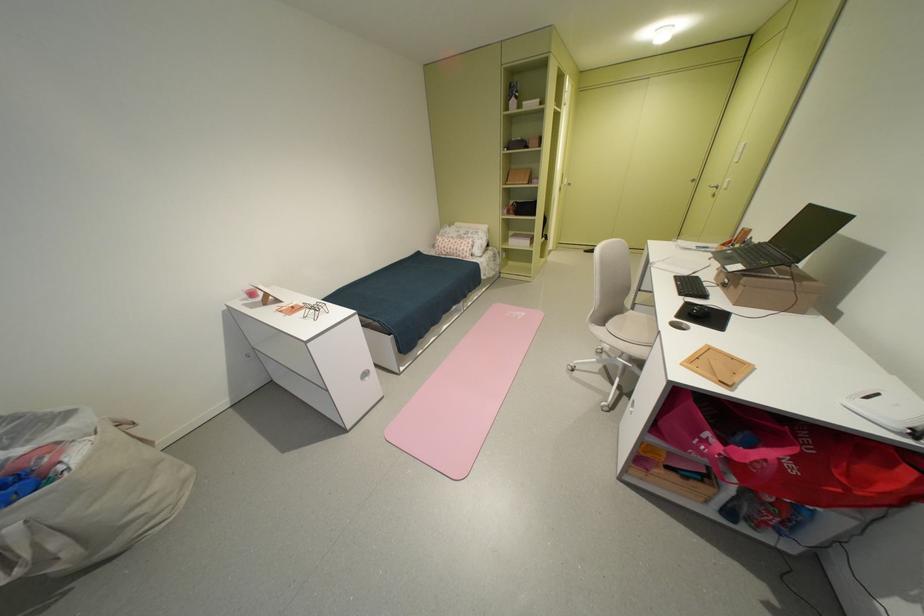
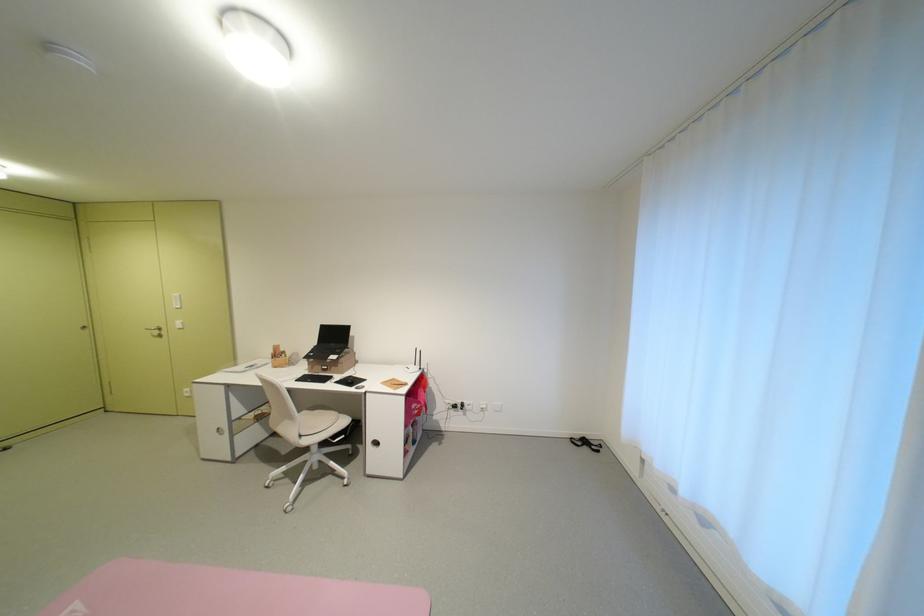
Find the pixel in the second image that matches point (615, 326) in the first image.

(311, 436)